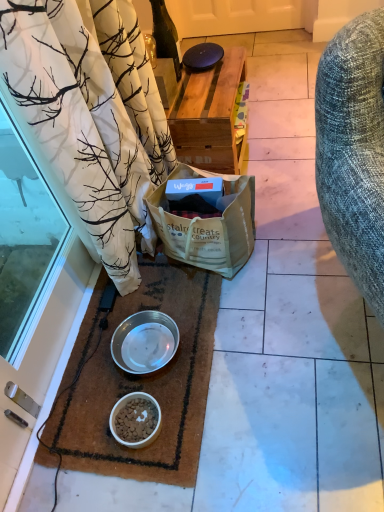
At what (x,y) coordinates should I click in order to perform the action: click on free space that is to the left of metallic silver bowl at lower center, acting as the 2th bowl starting from the bottom. Please return your answer as a coordinate pair (x, y). Looking at the image, I should click on (87, 371).